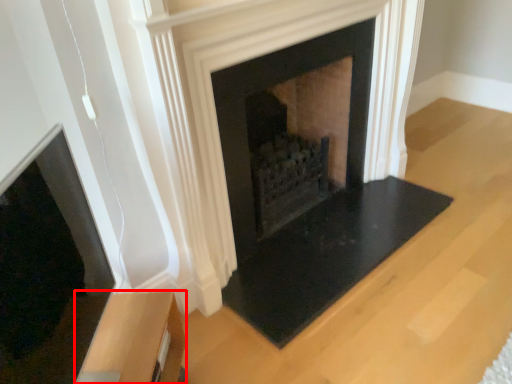
Question: Observing the image, what is the correct spatial positioning of furniture (annotated by the red box) in reference to fireplace?

Choices:
 (A) right
 (B) left

Answer: (B)